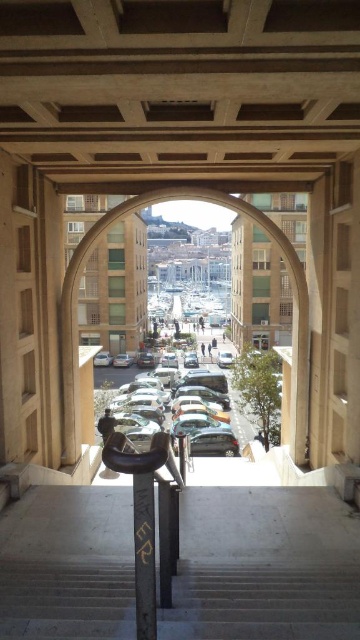
Question: From the image, what is the correct spatial relationship of gray concrete stairs at center in relation to shiny silver car at center?

Choices:
 (A) below
 (B) above

Answer: (A)

Question: Which point is closer to the camera?

Choices:
 (A) (33, 588)
 (B) (127, 371)

Answer: (A)

Question: In this image, where is gray concrete stairs at center located relative to shiny silver car at center?

Choices:
 (A) left
 (B) right

Answer: (B)

Question: Which point is farther from the camera taking this photo?

Choices:
 (A) pos(124,371)
 (B) pos(266,621)

Answer: (A)

Question: Does gray concrete stairs at center have a smaller size compared to shiny silver car at center?

Choices:
 (A) yes
 (B) no

Answer: (A)